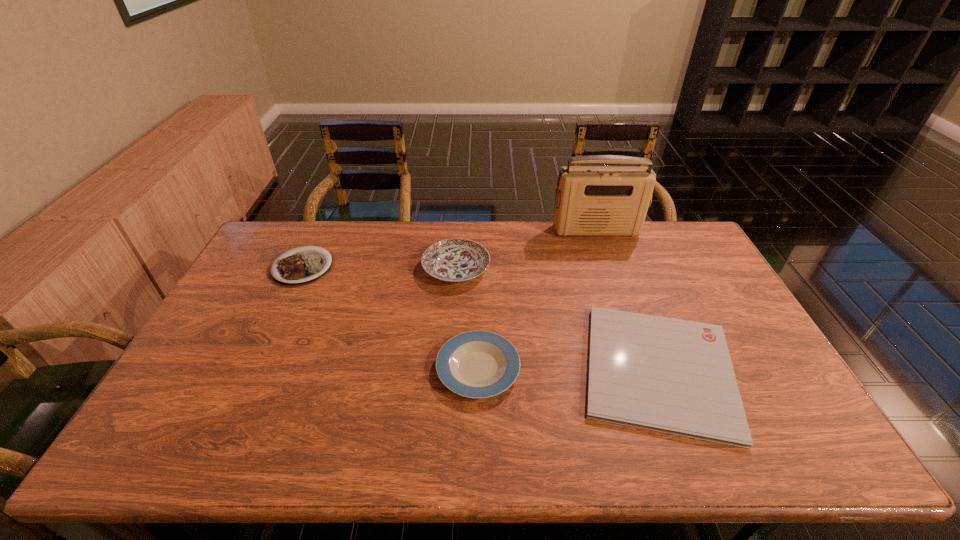
Locate an element on the screen. This screenshot has width=960, height=540. the tallest object is located at coordinates (590, 200).

Identify the location of radio receiver. This screenshot has height=540, width=960. (590, 200).

Locate an element on the screen. the second tallest object is located at coordinates [454, 260].

Locate an element on the screen. the leftmost plate is located at coordinates (299, 267).

At what (x,y) coordinates should I click in order to perform the action: click on the nearest plate. Please return your answer as a coordinate pair (x, y). The image size is (960, 540). Looking at the image, I should click on (476, 364).

Find the location of a particular element. Image resolution: width=960 pixels, height=540 pixels. clipboard is located at coordinates (674, 376).

Find the location of a particular element. This screenshot has width=960, height=540. vacant region located 0.380m on the front-facing side of the tallest object is located at coordinates (624, 313).

Locate an element on the screen. vacant space situated 0.320m on the left of the fourth shortest object is located at coordinates (328, 268).

Where is `vacant region located 0.150m on the front of the leftmost plate`? This screenshot has height=540, width=960. vacant region located 0.150m on the front of the leftmost plate is located at coordinates tap(276, 324).

Identify the location of vacant space located on the left of the nearest plate. This screenshot has width=960, height=540. (369, 368).